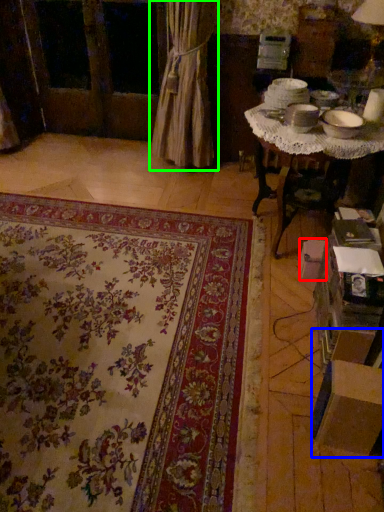
Question: Considering the real-world distances, which object is closest to cardboard box (highlighted by a red box)? cardboard box (highlighted by a blue box) or curtain (highlighted by a green box).

Choices:
 (A) cardboard box
 (B) curtain

Answer: (A)